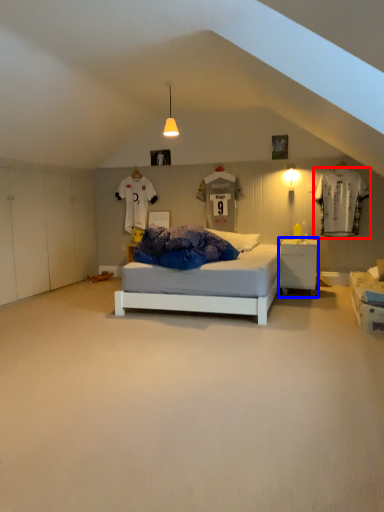
Question: Which object appears farthest to the camera in this image, laundry (highlighted by a red box) or nightstand (highlighted by a blue box)?

Choices:
 (A) laundry
 (B) nightstand

Answer: (A)